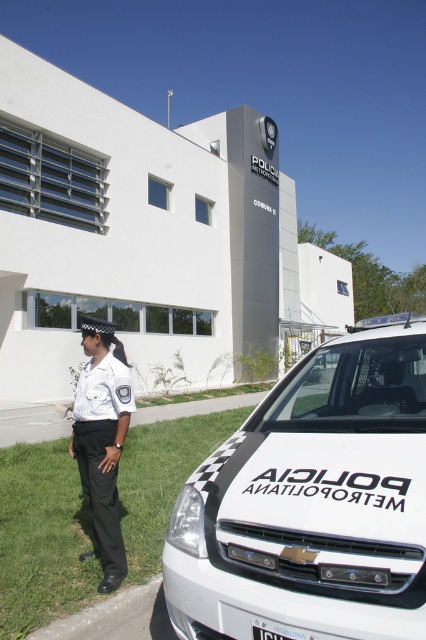
Question: Can you confirm if white glossy van at lower right is smaller than white uniform at center?

Choices:
 (A) no
 (B) yes

Answer: (A)

Question: Does white glossy van at lower right have a greater width compared to white uniform at center?

Choices:
 (A) yes
 (B) no

Answer: (A)

Question: Which point appears farthest from the camera in this image?

Choices:
 (A) (227, 557)
 (B) (86, 342)

Answer: (B)

Question: Is white glossy van at lower right bigger than white uniform at center?

Choices:
 (A) yes
 (B) no

Answer: (A)